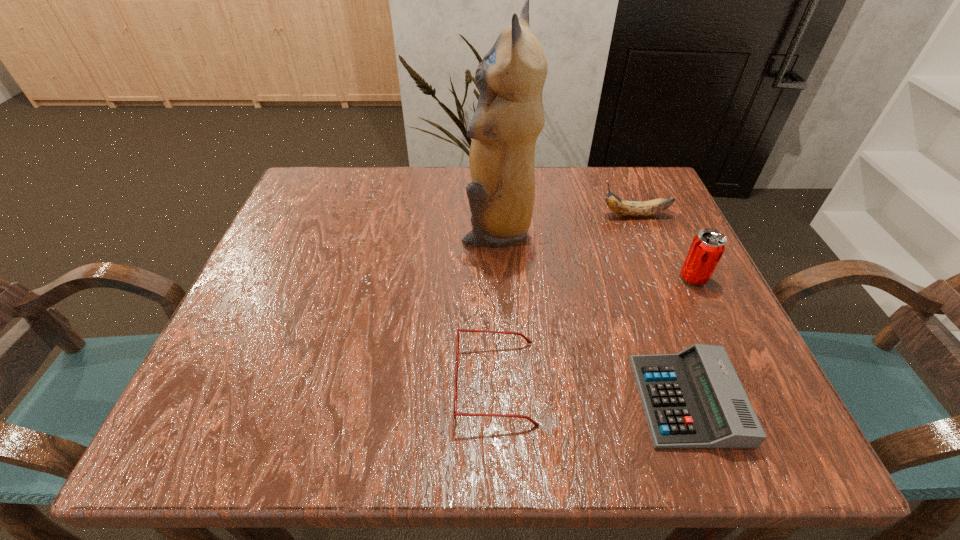
Find the location of a particular element. The width and height of the screenshot is (960, 540). the tallest object is located at coordinates [x=509, y=116].

The width and height of the screenshot is (960, 540). Identify the location of the second tallest object. (708, 246).

Locate an element on the screen. Image resolution: width=960 pixels, height=540 pixels. soda can is located at coordinates (708, 246).

This screenshot has width=960, height=540. What are the coordinates of `banana` in the screenshot? It's located at (627, 208).

What are the coordinates of `spectacles` in the screenshot? It's located at (456, 414).

You are a GUI agent. You are given a task and a screenshot of the screen. Output one action in this format:
    pyautogui.click(x=<x>, y=<y>)
    Task: Click on the shortest object
    This screenshot has height=540, width=960.
    Given the screenshot: What is the action you would take?
    pyautogui.click(x=693, y=399)

The height and width of the screenshot is (540, 960). I want to click on vacant space located on the face of the tallest object, so click(x=307, y=228).

Identify the location of vacant region located 0.210m on the face of the tallest object. (367, 228).

What are the coordinates of `free space located 0.290m on the face of the tallest object` in the screenshot? It's located at (330, 228).

Find the location of a particular element. This screenshot has height=540, width=960. vacant space located on the front of the soda can is located at coordinates [x=732, y=359].